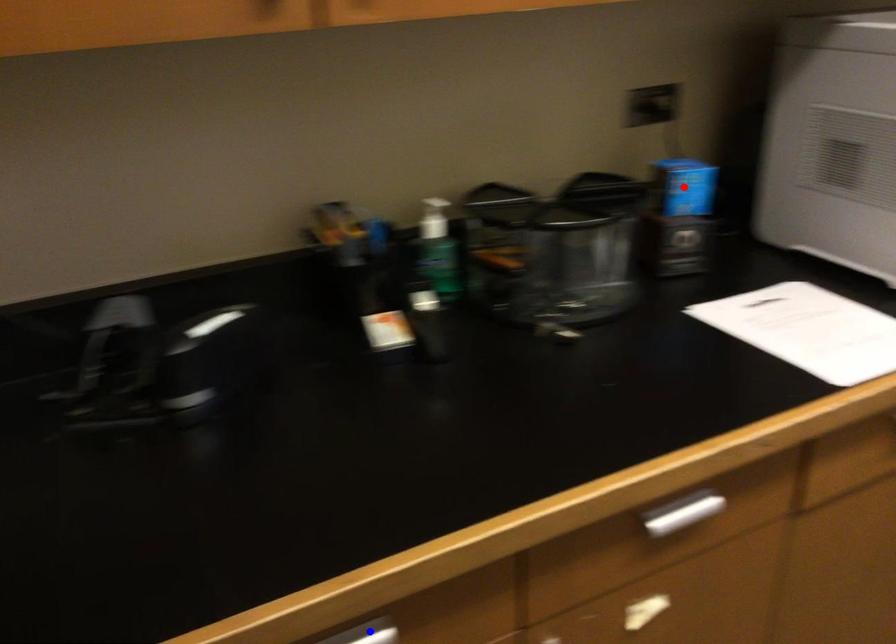
Question: Two points are marked on the image. Which point is closer to the camera?

Choices:
 (A) Blue point is closer.
 (B) Red point is closer.

Answer: (A)